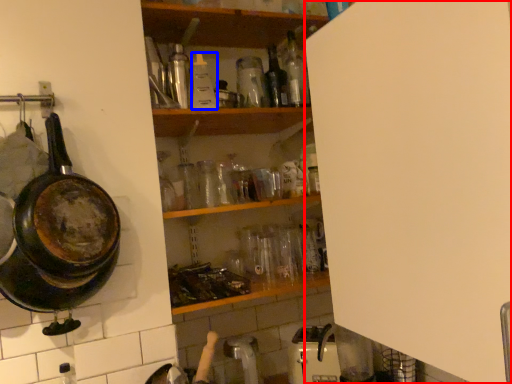
Question: Which object is closer to the camera taking this photo, side (highlighted by a red box) or bottle (highlighted by a blue box)?

Choices:
 (A) side
 (B) bottle

Answer: (A)